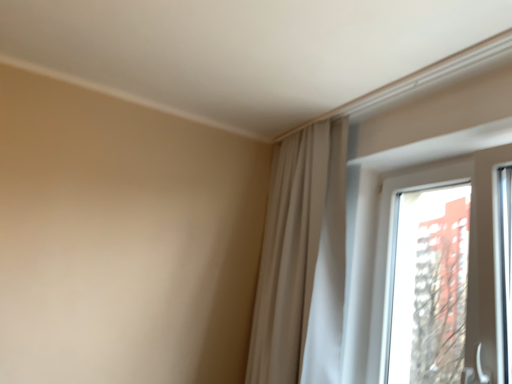
Identify the location of transparent glass window at upper right. The image size is (512, 384). (472, 248).

What do you see at coordinates (472, 248) in the screenshot?
I see `transparent glass window at upper right` at bounding box center [472, 248].

This screenshot has width=512, height=384. I want to click on transparent glass window at upper right, so click(472, 248).